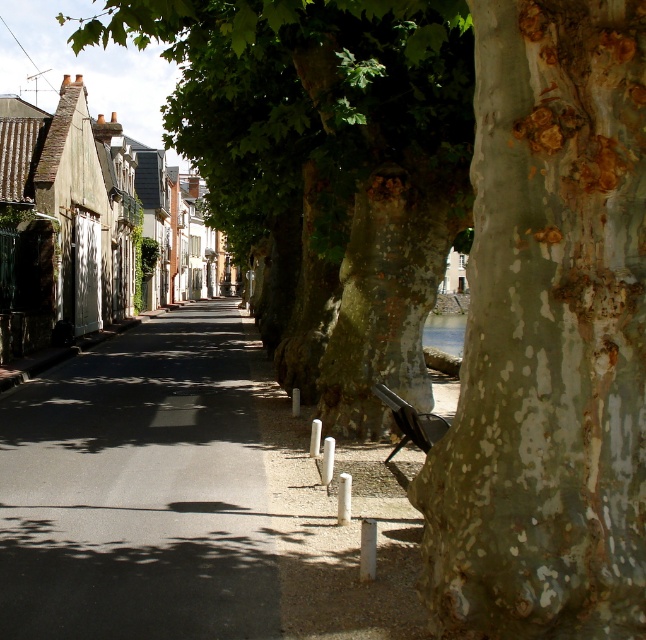
Is asphalt road at center above smooth bark tree at center?

No, asphalt road at center is not above smooth bark tree at center.

I want to click on asphalt road at center, so click(183, 500).

Which is more to the right, speckled bark tree trunk at center or asphalt road at center?

From the viewer's perspective, speckled bark tree trunk at center appears more on the right side.

Which of these two, speckled bark tree trunk at center or asphalt road at center, stands shorter?

asphalt road at center

What are the coordinates of `speckled bark tree trunk at center` in the screenshot? It's located at (547, 337).

Describe the element at coordinates (547, 337) in the screenshot. I see `speckled bark tree trunk at center` at that location.

Does speckled bark tree trunk at center have a larger size compared to smooth bark tree at center?

No.

Who is more distant from viewer, [579,481] or [300,340]?

Point [300,340]

This screenshot has height=640, width=646. I want to click on speckled bark tree trunk at center, so click(547, 337).